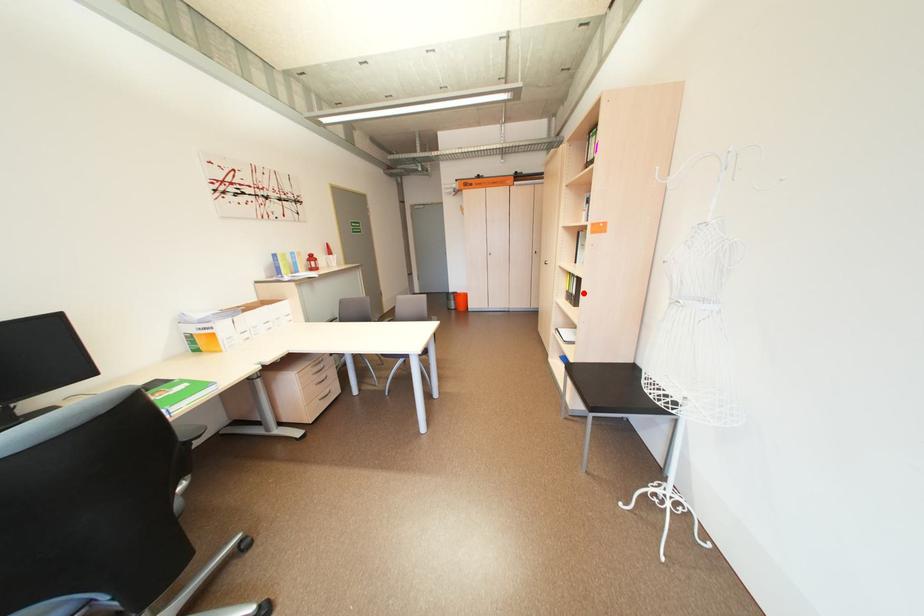
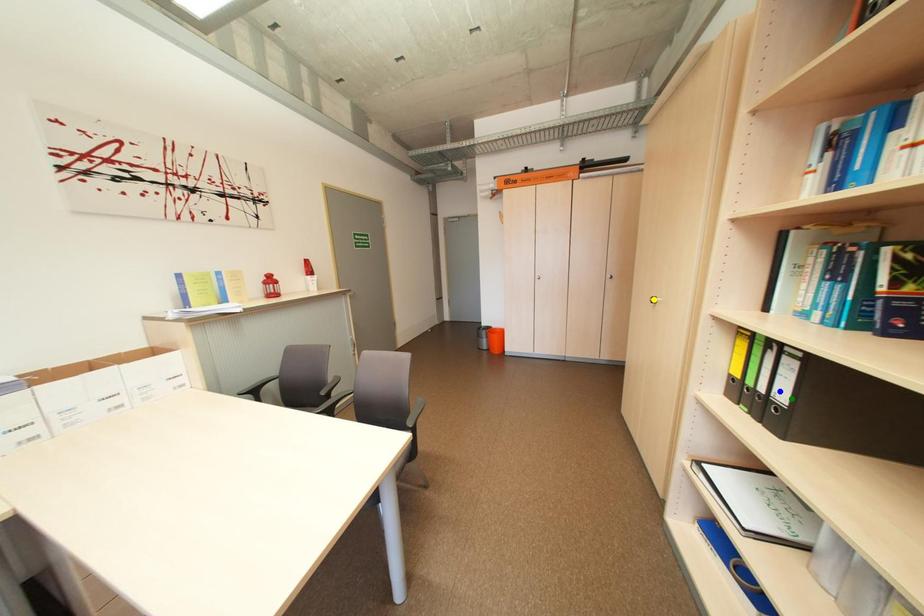
Question: I am providing you with two images of the same scene from different viewpoints. A red point is marked on the first image. You are given multiple points on the second image. Which spot in image 2 lines up with the point in image 1?

Choices:
 (A) yellow point
 (B) blue point
 (C) green point

Answer: (C)